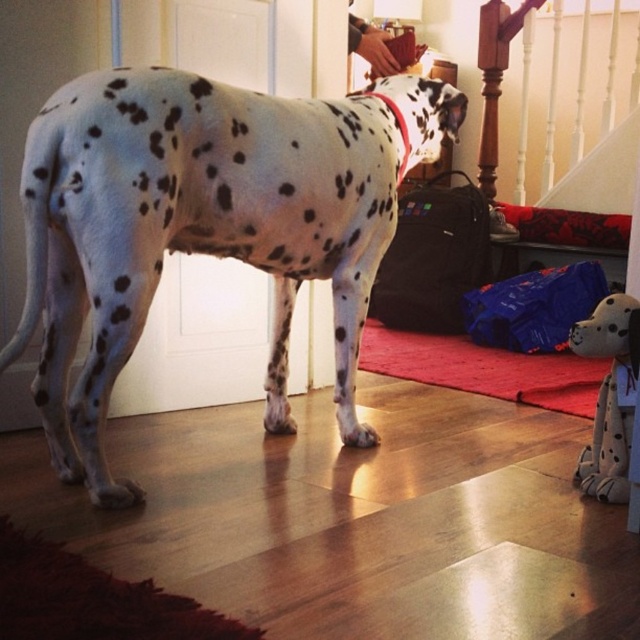
Find the location of a particular element. The height and width of the screenshot is (640, 640). white-spotted fur at center is located at coordinates (204, 225).

Who is more distant from viewer, (280, 348) or (582, 465)?

Positioned behind is point (280, 348).

Is point (280, 188) closer to camera compared to point (596, 440)?

That is True.

Locate an element on the screen. white-spotted fur at center is located at coordinates (204, 225).